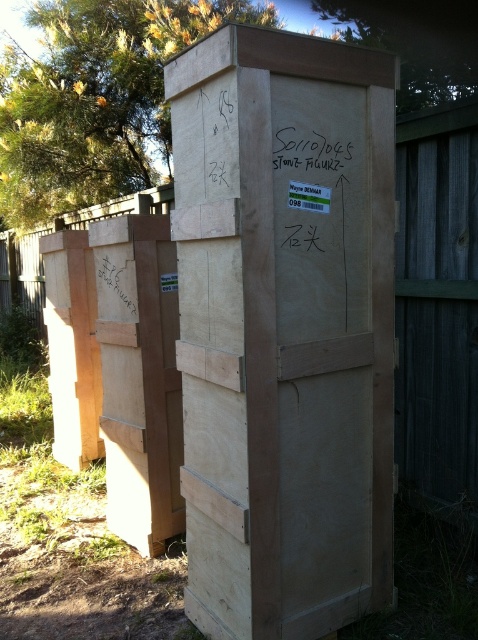
Question: Is the position of natural wood cardboard box at center more distant than that of light brown wood at center?

Choices:
 (A) yes
 (B) no

Answer: (B)

Question: Is natural wood cardboard box at center below light brown wood at center?

Choices:
 (A) no
 (B) yes

Answer: (A)

Question: Which point is closer to the camera?

Choices:
 (A) natural wood cardboard box at center
 (B) light brown wood at center

Answer: (A)

Question: Can you confirm if natural wood cardboard box at center is positioned above light brown wood at center?

Choices:
 (A) no
 (B) yes

Answer: (B)

Question: Which of the following is the closest to the observer?

Choices:
 (A) natural wood cardboard box at center
 (B) light brown wood at center

Answer: (A)